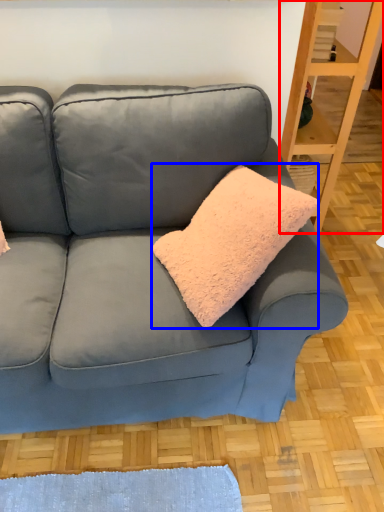
Question: Which object appears closest to the camera in this image, shelf (highlighted by a red box) or throw pillow (highlighted by a blue box)?

Choices:
 (A) shelf
 (B) throw pillow

Answer: (B)